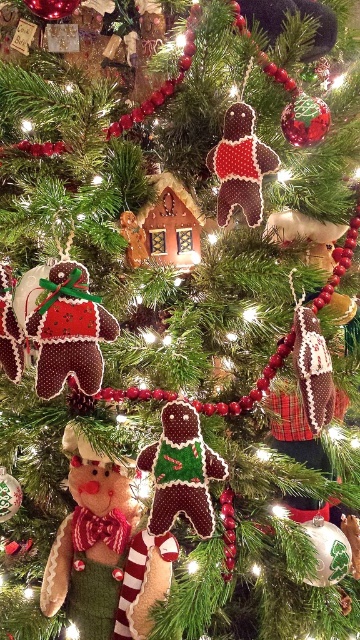
Question: Which point is farther from the camera taking this photo?

Choices:
 (A) (51, 556)
 (B) (194, 508)

Answer: (A)

Question: Which of the following is the farthest from the observer?

Choices:
 (A) (228, 196)
 (B) (160, 577)
 (C) (164, 493)

Answer: (B)

Question: Does green knitted gingerbread man at center appear under matte brown gingerbread man at center?

Choices:
 (A) yes
 (B) no

Answer: (A)

Question: Which of the following is the closest to the observer?

Choices:
 (A) (122, 468)
 (B) (267, 163)
 (C) (168, 440)

Answer: (C)

Question: Does green knitted gingerbread man at center lie behind green felt gingerbread man at center?

Choices:
 (A) yes
 (B) no

Answer: (A)

Question: Is green felt gingerbread man at center thinner than matte brown gingerbread man at center?

Choices:
 (A) no
 (B) yes

Answer: (A)